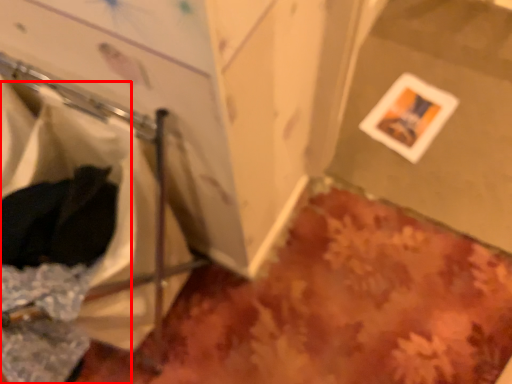
Question: Considering the relative positions of laundry (annotated by the red box) and picture frame in the image provided, where is laundry (annotated by the red box) located with respect to the staircase?

Choices:
 (A) right
 (B) left

Answer: (B)